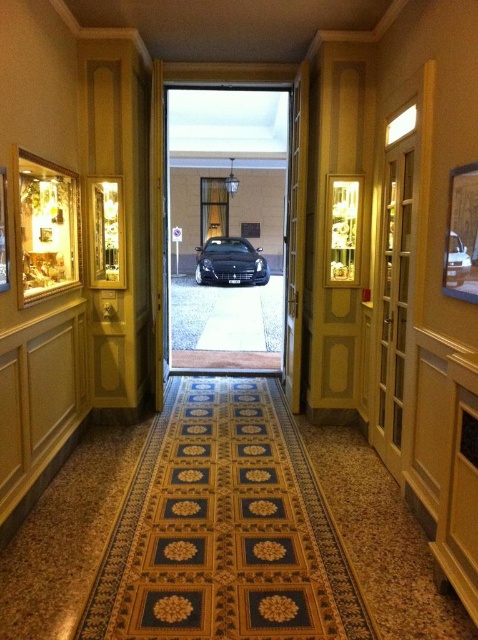
Question: Is wooden door at right positioned at the back of shiny black car at center?

Choices:
 (A) no
 (B) yes

Answer: (A)

Question: Which of the following is the closest to the observer?

Choices:
 (A) shiny black car at center
 (B) wooden door at right

Answer: (B)

Question: Is wooden door at right positioned before shiny black car at center?

Choices:
 (A) no
 (B) yes

Answer: (B)

Question: Which point is closer to the camera?

Choices:
 (A) shiny black car at center
 (B) wooden door at right

Answer: (B)

Question: Can you confirm if wooden door at right is positioned to the right of shiny black car at center?

Choices:
 (A) yes
 (B) no

Answer: (A)

Question: Which object appears closest to the camera in this image?

Choices:
 (A) shiny black car at center
 (B) wooden door at right

Answer: (B)